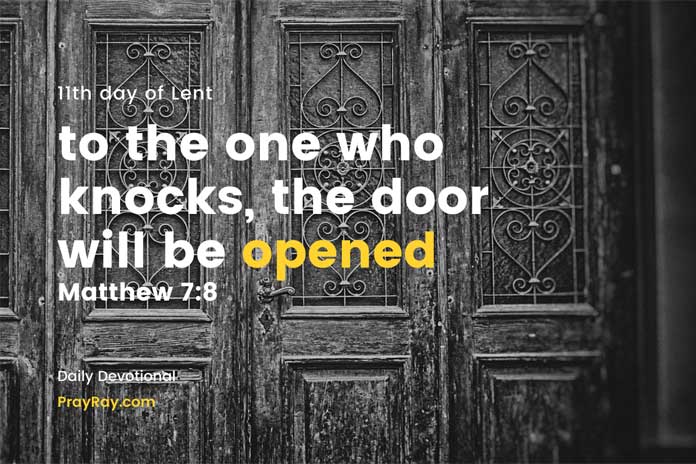
This screenshot has width=696, height=464. Identify the location of lock. 267,311.